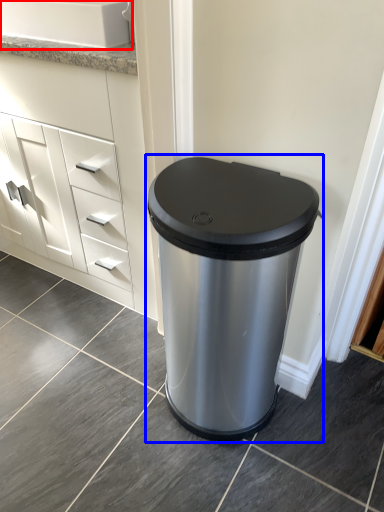
Question: Which object appears closest to the camera in this image, sink (highlighted by a red box) or waste container (highlighted by a blue box)?

Choices:
 (A) sink
 (B) waste container

Answer: (B)